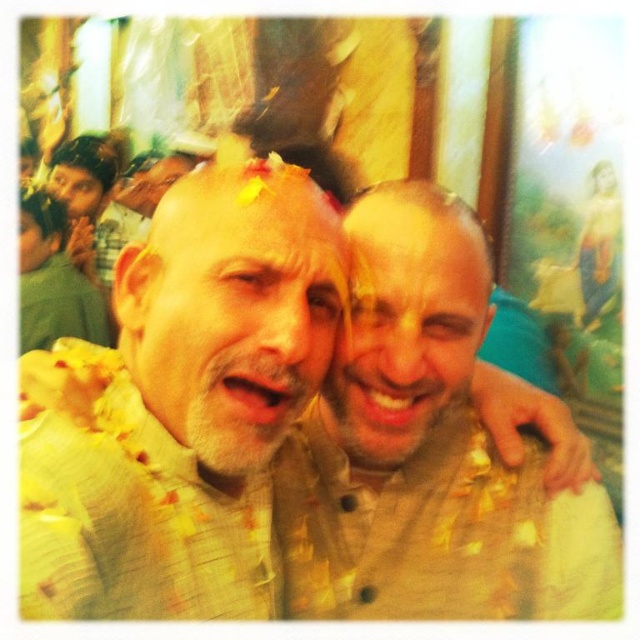
Question: Which of the following is the farthest from the observer?

Choices:
 (A) (60, 170)
 (B) (163, 403)
 (C) (253, 212)
 (D) (445, 348)

Answer: (A)

Question: Among these objects, which one is nearest to the camera?

Choices:
 (A) smooth beige face at center
 (B) matte gold face at center

Answer: (B)

Question: Is matte beige kurta at center above brown matte beard at upper left?

Choices:
 (A) no
 (B) yes

Answer: (A)

Question: Which of the following is the farthest from the observer?

Choices:
 (A) matte beige kurta at center
 (B) matte gold face at center
 (C) brown matte beard at upper left
 (D) yellow glitter at center

Answer: (C)

Question: Is matte beige kurta at center to the left of matte gold face at center from the viewer's perspective?

Choices:
 (A) yes
 (B) no

Answer: (B)

Question: Does smooth beige face at center have a smaller size compared to yellow glitter at center?

Choices:
 (A) no
 (B) yes

Answer: (A)